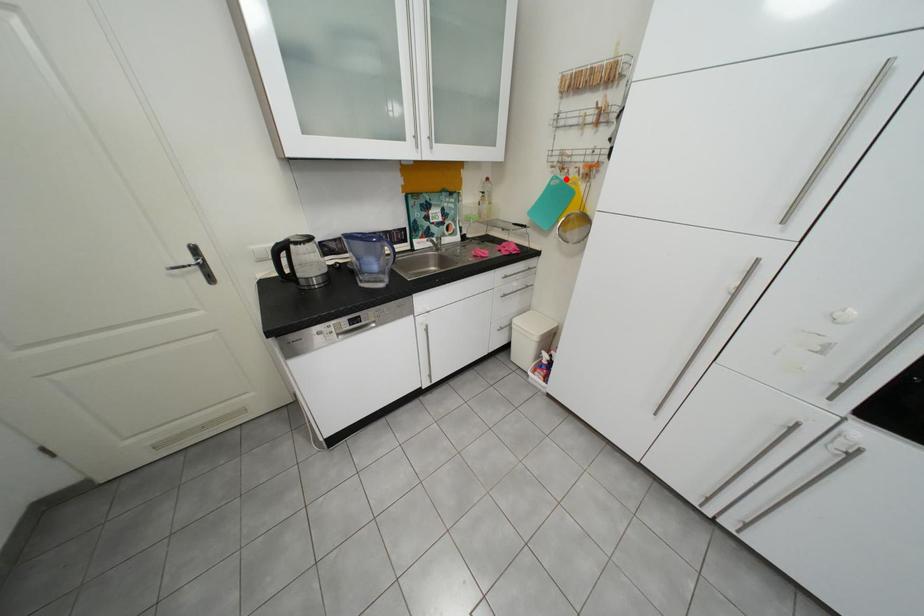
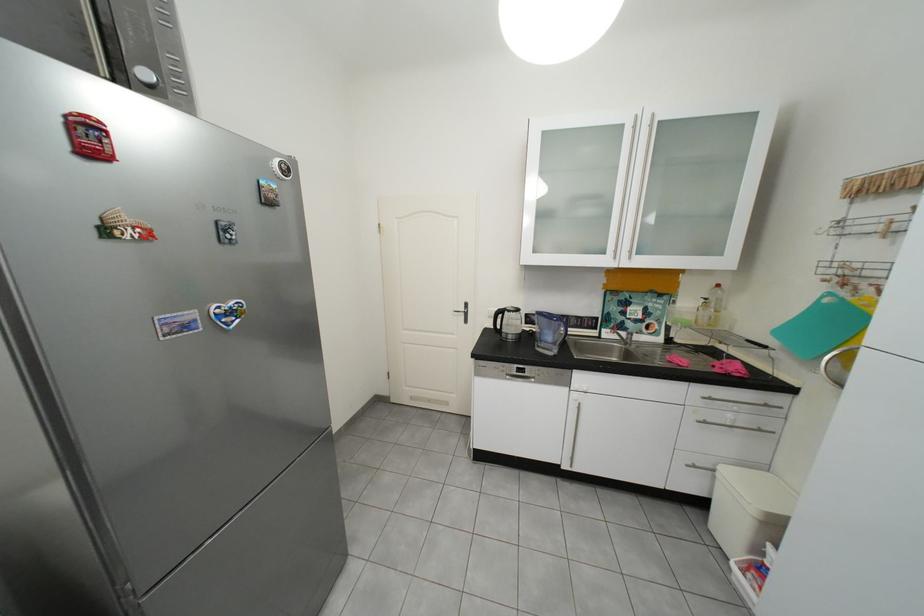
The point at the highlighted location is marked in the first image. Where is the corresponding point in the second image?

(841, 296)